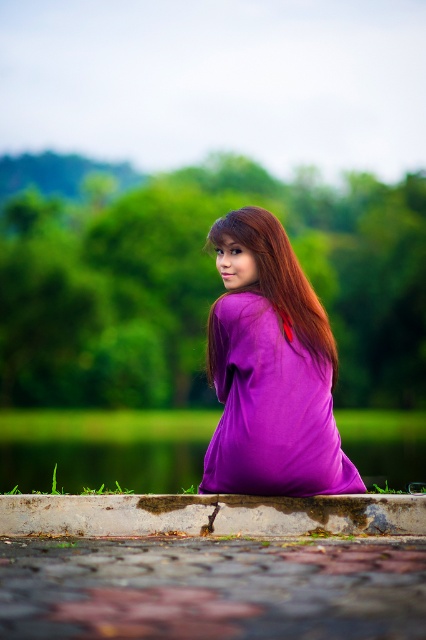
Question: Which point is farther to the camera?

Choices:
 (A) purple matte dress at center
 (B) concrete curb at lower center

Answer: (A)

Question: Can you confirm if purple matte dress at center is positioned to the left of concrete curb at lower center?

Choices:
 (A) yes
 (B) no

Answer: (B)

Question: Which object appears closest to the camera in this image?

Choices:
 (A) concrete curb at lower center
 (B) purple matte dress at center

Answer: (A)

Question: Can you confirm if purple matte dress at center is positioned to the right of concrete curb at lower center?

Choices:
 (A) no
 (B) yes

Answer: (B)

Question: Is purple matte dress at center to the left of concrete curb at lower center from the viewer's perspective?

Choices:
 (A) no
 (B) yes

Answer: (A)